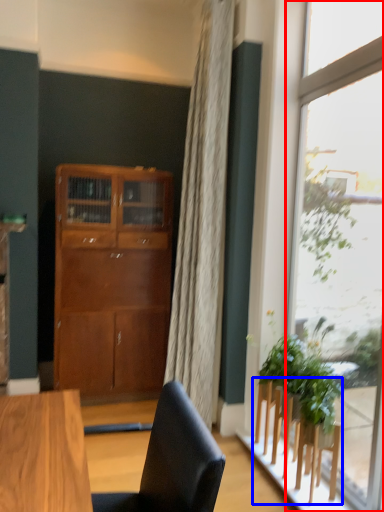
Question: Which object is further to the camera taking this photo, window (highlighted by a red box) or furniture (highlighted by a blue box)?

Choices:
 (A) window
 (B) furniture

Answer: (B)